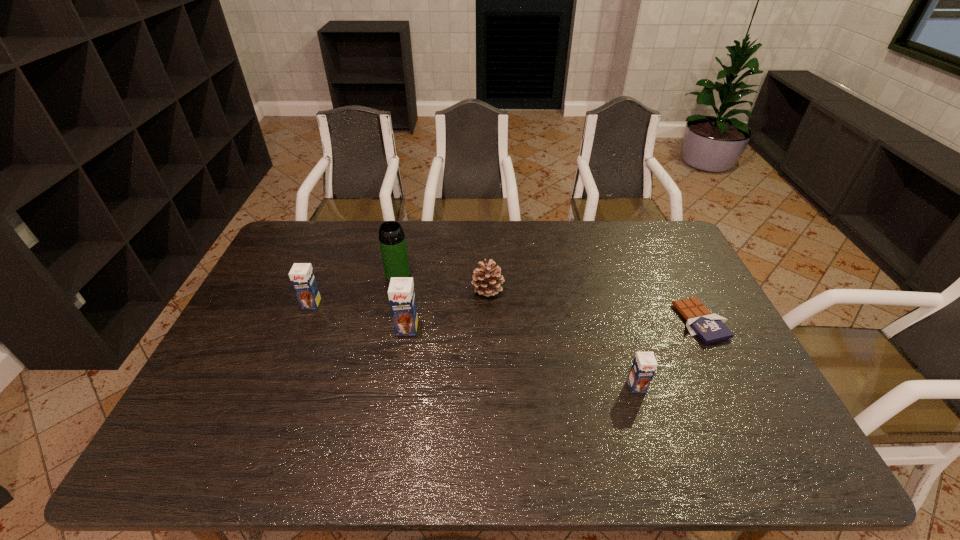
Image resolution: width=960 pixels, height=540 pixels. In order to click on the second tallest chocolate milk in this screenshot , I will do click(302, 277).

Where is `the fourth shortest object`? This screenshot has height=540, width=960. the fourth shortest object is located at coordinates (302, 277).

This screenshot has height=540, width=960. In order to click on the tallest chocolate milk in this screenshot , I will do `click(401, 292)`.

I want to click on the second farthest chocolate milk, so click(x=401, y=292).

Locate an element on the screen. The image size is (960, 540). the shortest chocolate milk is located at coordinates (644, 365).

Image resolution: width=960 pixels, height=540 pixels. Find the location of `the nearest chocolate milk`. the nearest chocolate milk is located at coordinates (644, 365).

The width and height of the screenshot is (960, 540). I want to click on chocolate bar, so click(x=709, y=327).

Image resolution: width=960 pixels, height=540 pixels. In order to click on the rightmost object in this screenshot , I will do `click(709, 327)`.

At what (x,y) coordinates should I click in order to perform the action: click on pinecone. Please return your answer as a coordinate pair (x, y). Image resolution: width=960 pixels, height=540 pixels. Looking at the image, I should click on (487, 279).

Locate an element on the screen. The height and width of the screenshot is (540, 960). thermos bottle is located at coordinates (392, 241).